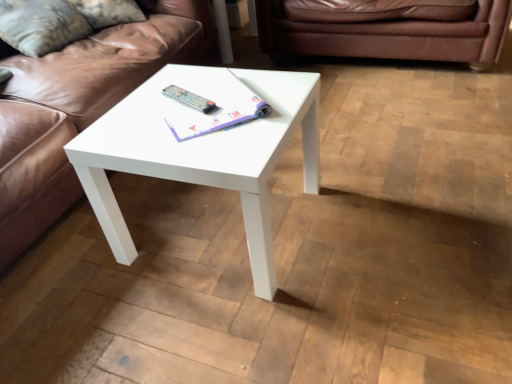
Locate an element on the screen. free space to the left of white glossy coffee table at center is located at coordinates (85, 260).